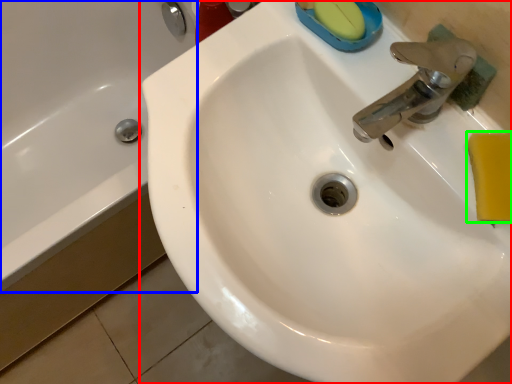
Question: Which object is the farthest from sink (highlighted by a red box)? Choose among these: bath (highlighted by a blue box) or soap (highlighted by a green box).

Choices:
 (A) bath
 (B) soap

Answer: (A)